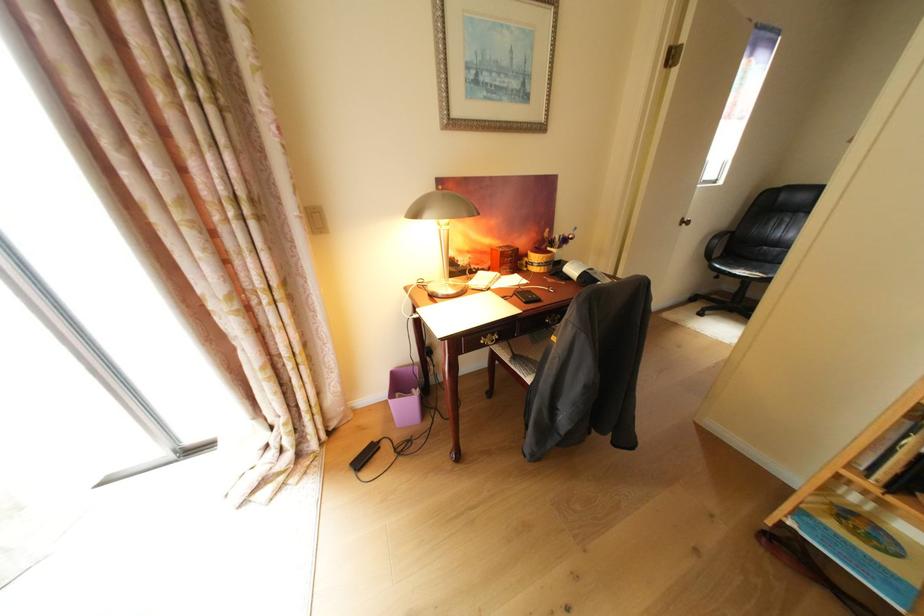
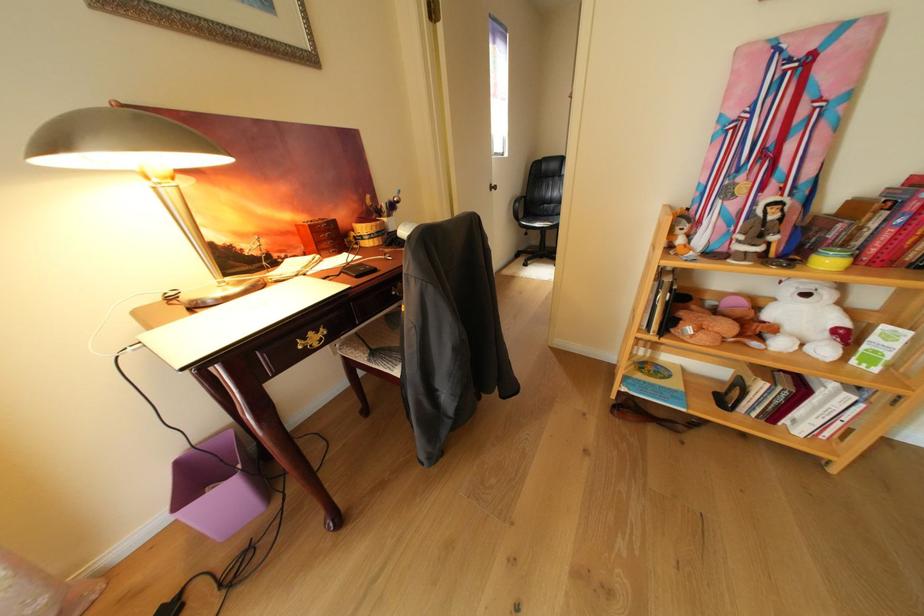
The point at [516,353] is marked in the first image. Where is the corresponding point in the second image?

(371, 354)